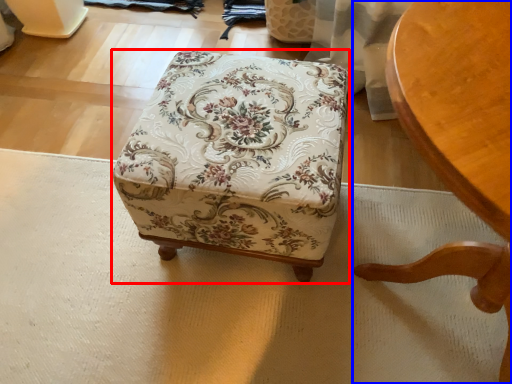
Question: Which of the following is the closest to the observer, furniture (highlighted by a red box) or chair (highlighted by a blue box)?

Choices:
 (A) furniture
 (B) chair

Answer: (B)